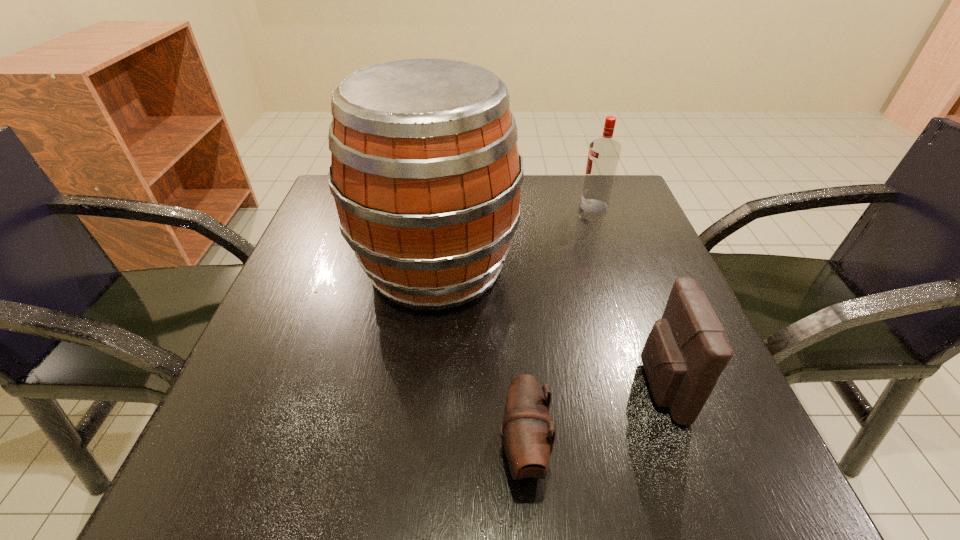
The width and height of the screenshot is (960, 540). I want to click on object that is at the near edge, so click(528, 441).

Where is `object that is at the left edge`? This screenshot has width=960, height=540. object that is at the left edge is located at coordinates (425, 171).

Locate an element on the screen. This screenshot has height=540, width=960. vodka present at the right edge is located at coordinates (603, 156).

Where is `pouch located at the right edge`? pouch located at the right edge is located at coordinates (685, 353).

The height and width of the screenshot is (540, 960). What are the coordinates of `object located at the far left corner` in the screenshot? It's located at (425, 171).

Image resolution: width=960 pixels, height=540 pixels. I want to click on object at the far right corner, so click(603, 156).

Locate an element on the screen. free region at the far edge is located at coordinates (x=524, y=210).

Identify the location of free space at the near edge of the desktop. The image size is (960, 540). (499, 447).

Where is `vacant region at the left edge of the desktop`? Image resolution: width=960 pixels, height=540 pixels. vacant region at the left edge of the desktop is located at coordinates (266, 313).

Locate an element on the screen. This screenshot has width=960, height=540. free location at the far right corner of the desktop is located at coordinates (574, 179).